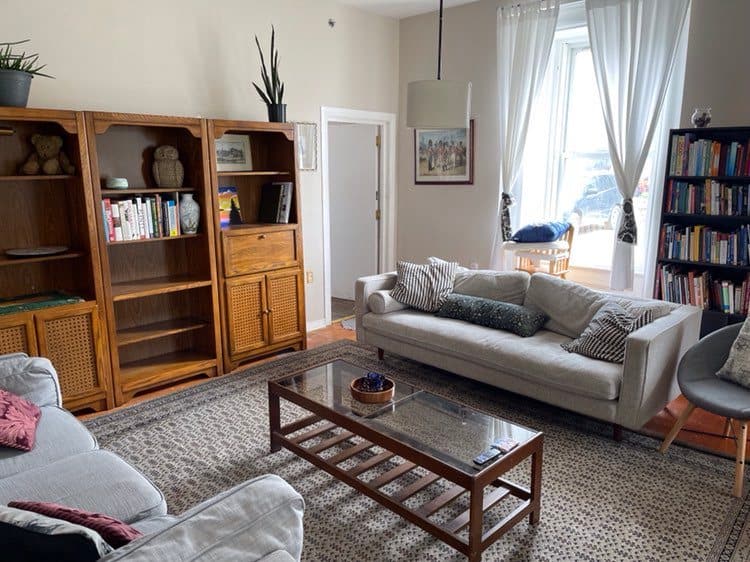
Where is `potted plant`? The height and width of the screenshot is (562, 750). potted plant is located at coordinates (14, 65), (274, 96).